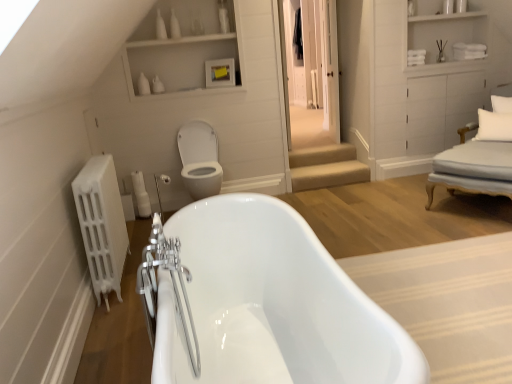
Question: Is white fabric pillow at upper right, placed as the 1th pillow when sorted from top to bottom, thinner than white matte radiator at left?

Choices:
 (A) yes
 (B) no

Answer: (A)

Question: Is the depth of white fabric pillow at upper right, the 2th pillow when ordered from bottom to top, less than that of white matte radiator at left?

Choices:
 (A) no
 (B) yes

Answer: (A)

Question: Is white fabric pillow at upper right, the 2th pillow when ordered from bottom to top, shorter than white matte radiator at left?

Choices:
 (A) yes
 (B) no

Answer: (A)

Question: Is white fabric pillow at upper right, placed as the 1th pillow when sorted from top to bottom, facing towards white matte radiator at left?

Choices:
 (A) no
 (B) yes

Answer: (B)

Question: Is white fabric pillow at upper right, placed as the 1th pillow when sorted from top to bottom, facing away from white matte radiator at left?

Choices:
 (A) yes
 (B) no

Answer: (B)

Question: From a real-world perspective, relative to white soft pillow at right, which is counted as the second pillow, starting from the top, is white fabric armchair at right vertically above or below?

Choices:
 (A) above
 (B) below

Answer: (B)

Question: From the image's perspective, is white fabric armchair at right positioned above or below white soft pillow at right, which is counted as the second pillow, starting from the top?

Choices:
 (A) above
 (B) below

Answer: (A)

Question: Is white fabric armchair at right in front of or behind white soft pillow at right, which is counted as the second pillow, starting from the top, in the image?

Choices:
 (A) front
 (B) behind

Answer: (A)

Question: Based on their positions, is white fabric armchair at right located to the left or right of white soft pillow at right, which is counted as the second pillow, starting from the top?

Choices:
 (A) left
 (B) right

Answer: (B)

Question: In terms of size, does white wood cabinet at upper right appear bigger or smaller than transparent glass door at center?

Choices:
 (A) big
 (B) small

Answer: (A)

Question: From the image's perspective, is white wood cabinet at upper right located above or below transparent glass door at center?

Choices:
 (A) above
 (B) below

Answer: (A)

Question: Do you think white wood cabinet at upper right is within transparent glass door at center, or outside of it?

Choices:
 (A) outside
 (B) inside

Answer: (A)

Question: Is point (453, 16) closer or farther from the camera than point (280, 8)?

Choices:
 (A) farther
 (B) closer

Answer: (A)

Question: Considering their positions, is white wood cabinet at upper right located in front of or behind white soft pillow at right, which is counted as the second pillow, starting from the top?

Choices:
 (A) front
 (B) behind

Answer: (B)

Question: From the image's perspective, is white wood cabinet at upper right located above or below white soft pillow at right, the first pillow positioned from the bottom?

Choices:
 (A) above
 (B) below

Answer: (A)